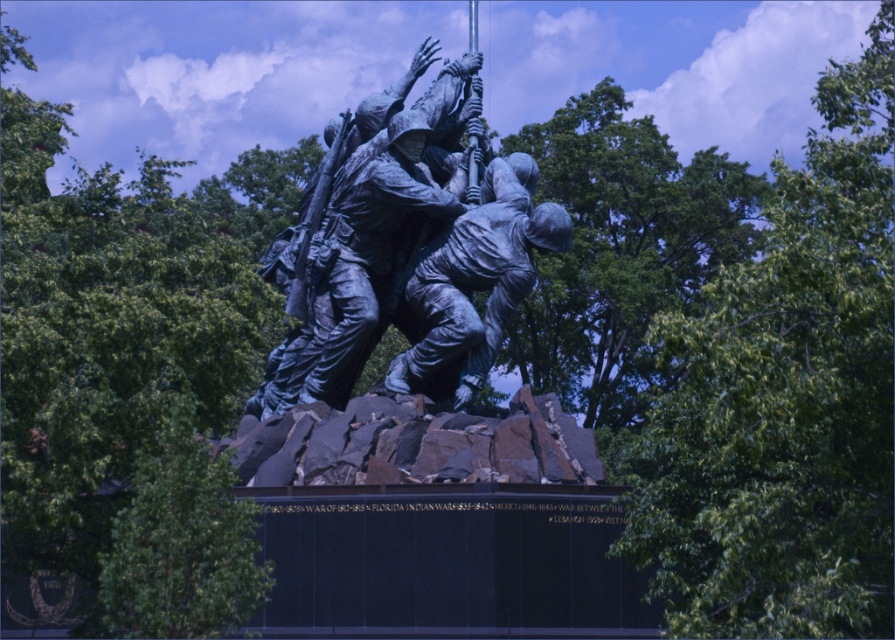
Can you confirm if blue-green polished bronze statue at center is positioned to the left of bronze statue of soldiers at center?

Incorrect, blue-green polished bronze statue at center is not on the left side of bronze statue of soldiers at center.

This screenshot has height=640, width=895. I want to click on blue-green polished bronze statue at center, so click(x=367, y=228).

Is bronze statue of soldiers at center above bronze statue of soldier at center?

Actually, bronze statue of soldiers at center is below bronze statue of soldier at center.

What do you see at coordinates (355, 266) in the screenshot? I see `bronze statue of soldiers at center` at bounding box center [355, 266].

Find the location of a particular element. bronze statue of soldiers at center is located at coordinates (355, 266).

Does blue-green polished bronze statue at center have a greater height compared to bronze statue of soldier at center?

Indeed, blue-green polished bronze statue at center has a greater height compared to bronze statue of soldier at center.

Looking at this image, does blue-green polished bronze statue at center appear over bronze statue of soldier at center?

Yes, blue-green polished bronze statue at center is above bronze statue of soldier at center.

What do you see at coordinates (367, 228) in the screenshot?
I see `blue-green polished bronze statue at center` at bounding box center [367, 228].

Image resolution: width=895 pixels, height=640 pixels. Identify the location of blue-green polished bronze statue at center. (367, 228).